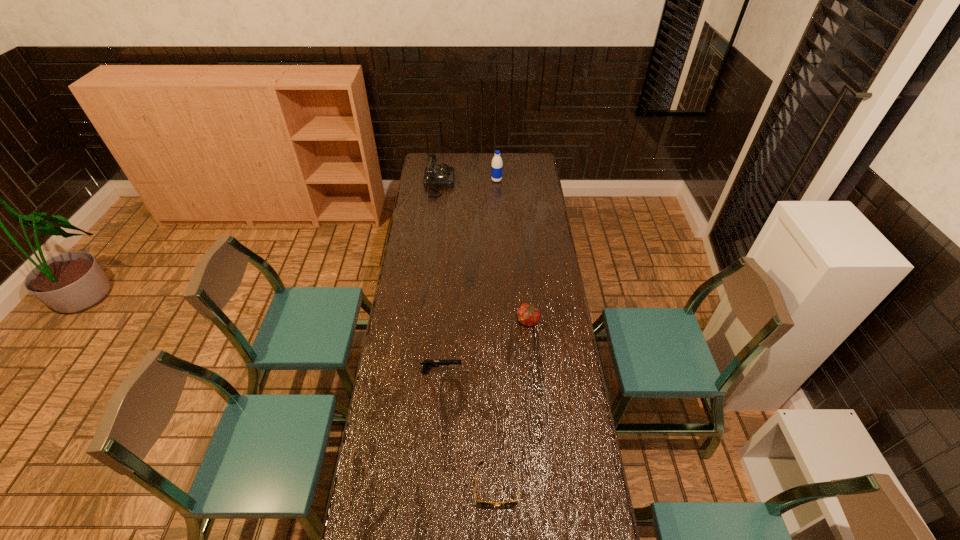
At what (x,y) coordinates should I click in order to perform the action: click on vacant position in the image that satisfies the following two spatial constraints: 1. on the front side of the tallest object; 2. at the aiming end of the gun. Please return your answer as a coordinate pair (x, y). Looking at the image, I should click on (505, 372).

At what (x,y) coordinates should I click in order to perform the action: click on vacant area in the image that satisfies the following two spatial constraints: 1. on the dial of the fourth shortest object; 2. on the right side of the tomato. Please return your answer as a coordinate pair (x, y). The width and height of the screenshot is (960, 540). Looking at the image, I should click on (423, 321).